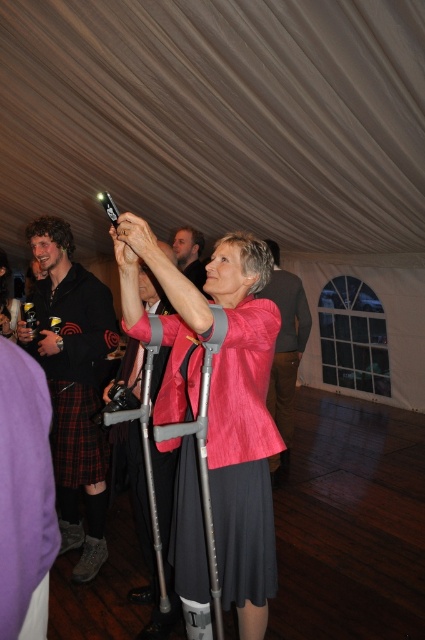
You are at the event and want to place a small decoration between the two points marked as point (x=218, y=451) and point (x=96, y=438). Which point should the decoration be closer to in order to be nearer to the viewer?

The decoration should be closer to point (x=218, y=451) because it is nearer to the viewer compared to point (x=96, y=438).

Based on the photo, you are a photographer setting up a shoot in this tented event space. You need to position the pink fabric crutches at center and the black kilt at left so that they are both visible in the frame. Which object should you place closer to the camera to ensure both are in focus?

To ensure both the pink fabric crutches at center and the black kilt at left are in focus, you should place the pink fabric crutches at center closer to the camera since it is smaller than the black kilt at left. This adjustment helps balance their sizes in the frame, making both objects clearly visible.